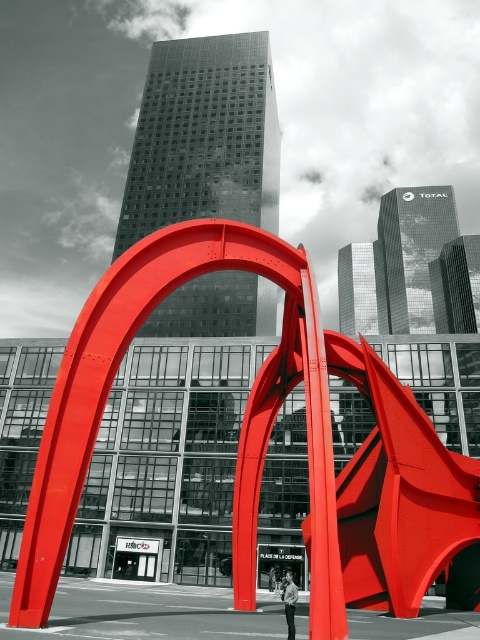
You are a photographer planning to take a photo of the metallic red arch at center and the light brown leather jacket at center. You want to ensure both are visible in the frame. Based on their positions, which object should you position first to capture both effectively?

The metallic red arch at center is positioned on the right side of light brown leather jacket at center. To capture both effectively, you should position the camera to include the light brown leather jacket at center first, then adjust to ensure the metallic red arch at center on its right is also in frame.

You are standing in front of the sculpture and want to take a photo that includes both the metallic red arch at center and the skyscraper with the logo

The metallic red arch at center is 24.28 feet away from you, so you can step back to ensure both the metallic red arch at center and the skyscraper with the logo are in the frame.

You are standing in front of the large red sculpture and looking at the point with coordinates point (x=263, y=440). What object is located at that point?

The point (x=263, y=440) corresponds to the metallic red arch at center.